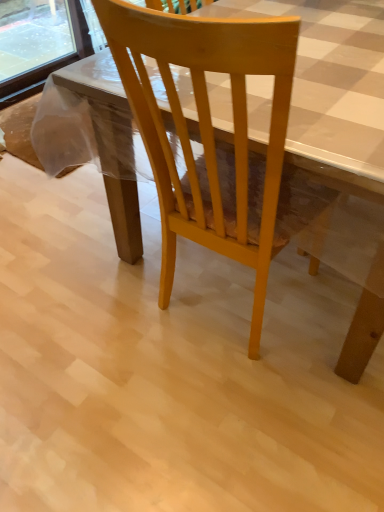
Find the location of `light wood chair at center`. light wood chair at center is located at coordinates (206, 126).

In order to face light wood chair at center, should I rotate leftwards or rightwards?

It's best to rotate right around 6.545 degrees.

This screenshot has width=384, height=512. What do you see at coordinates (206, 126) in the screenshot? I see `light wood chair at center` at bounding box center [206, 126].

Locate an element on the screen. Image resolution: width=384 pixels, height=512 pixels. light wood chair at center is located at coordinates (206, 126).